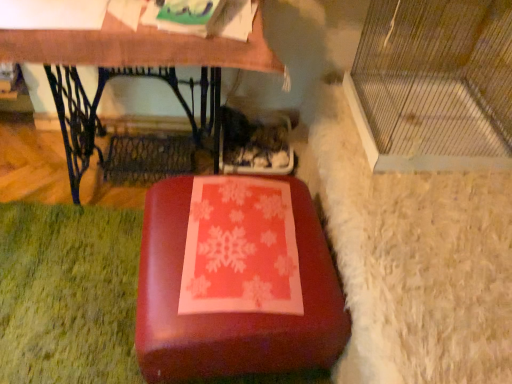
Question: In the image, is matte red suitcase at center positioned in front of or behind clear plastic cage at right?

Choices:
 (A) front
 (B) behind

Answer: (B)

Question: From the image's perspective, is matte red suitcase at center positioned above or below clear plastic cage at right?

Choices:
 (A) above
 (B) below

Answer: (B)

Question: Which object is positioned farthest from the matte wood table at center?

Choices:
 (A) matte red suitcase at center
 (B) clear plastic cage at right

Answer: (A)

Question: Which object is positioned farthest from the clear plastic cage at right?

Choices:
 (A) matte red suitcase at center
 (B) matte wood table at center

Answer: (A)